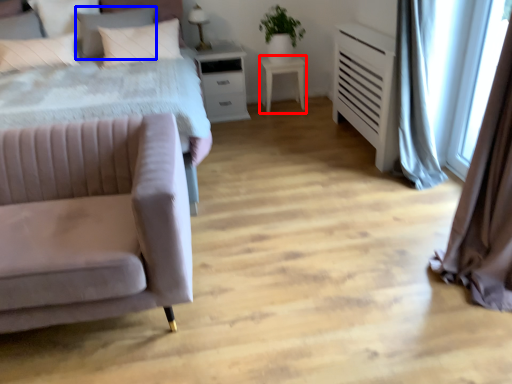
Question: Which of the following is the closest to the observer, table (highlighted by a red box) or pillow (highlighted by a blue box)?

Choices:
 (A) table
 (B) pillow

Answer: (B)